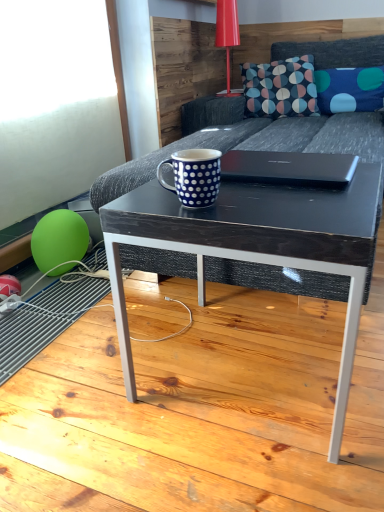
Find the location of a particular element. The height and width of the screenshot is (512, 384). vacant space to the right of blue dotted mug at center is located at coordinates (256, 195).